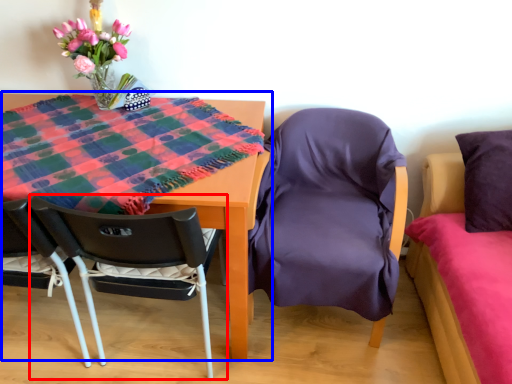
Question: Which object appears farthest to the camera in this image, chair (highlighted by a red box) or table (highlighted by a blue box)?

Choices:
 (A) chair
 (B) table

Answer: (A)